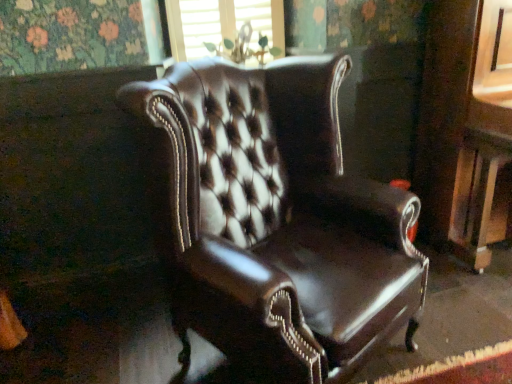
Question: Can you confirm if shiny brown leather chair at center is positioned to the left of wooden window frame at upper center?

Choices:
 (A) no
 (B) yes

Answer: (A)

Question: Does shiny brown leather chair at center touch wooden window frame at upper center?

Choices:
 (A) no
 (B) yes

Answer: (A)

Question: From the image's perspective, would you say shiny brown leather chair at center is shown under wooden window frame at upper center?

Choices:
 (A) no
 (B) yes

Answer: (B)

Question: Is shiny brown leather chair at center looking in the opposite direction of wooden window frame at upper center?

Choices:
 (A) no
 (B) yes

Answer: (B)

Question: Is shiny brown leather chair at center facing towards wooden window frame at upper center?

Choices:
 (A) yes
 (B) no

Answer: (B)

Question: Considering the relative sizes of shiny brown leather chair at center and wooden window frame at upper center in the image provided, is shiny brown leather chair at center bigger than wooden window frame at upper center?

Choices:
 (A) yes
 (B) no

Answer: (A)

Question: Is wooden window frame at upper center taller than shiny brown leather chair at center?

Choices:
 (A) no
 (B) yes

Answer: (A)

Question: Can you confirm if wooden window frame at upper center is positioned to the left of shiny brown leather chair at center?

Choices:
 (A) no
 (B) yes

Answer: (B)

Question: Is wooden window frame at upper center far from shiny brown leather chair at center?

Choices:
 (A) yes
 (B) no

Answer: (B)

Question: From a real-world perspective, is wooden window frame at upper center below shiny brown leather chair at center?

Choices:
 (A) yes
 (B) no

Answer: (B)

Question: Can you confirm if wooden window frame at upper center is thinner than shiny brown leather chair at center?

Choices:
 (A) no
 (B) yes

Answer: (B)

Question: Is wooden window frame at upper center not inside shiny brown leather chair at center?

Choices:
 (A) yes
 (B) no

Answer: (A)

Question: Considering the positions of wooden window frame at upper center and shiny brown leather chair at center in the image, is wooden window frame at upper center taller or shorter than shiny brown leather chair at center?

Choices:
 (A) short
 (B) tall

Answer: (A)